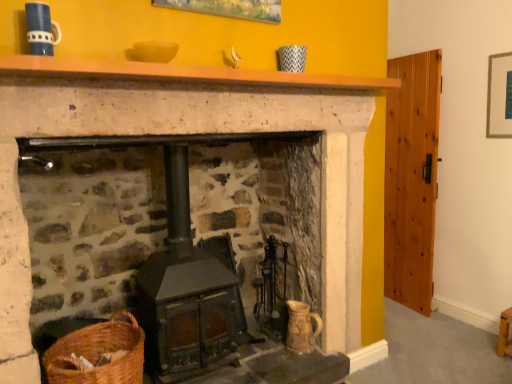
The width and height of the screenshot is (512, 384). Find the location of `vacant region to the left of wooden stool at lower right`. vacant region to the left of wooden stool at lower right is located at coordinates (485, 349).